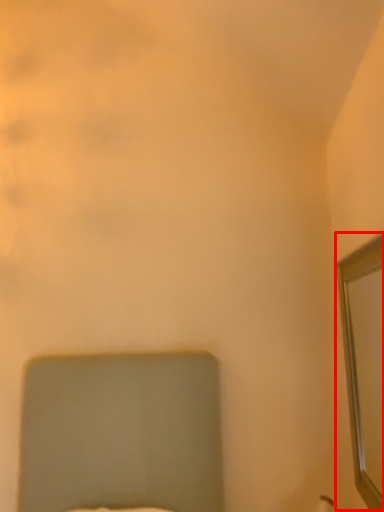
Question: From the image's perspective, what is the correct spatial positioning of mirror (annotated by the red box) in reference to bed?

Choices:
 (A) above
 (B) below

Answer: (A)